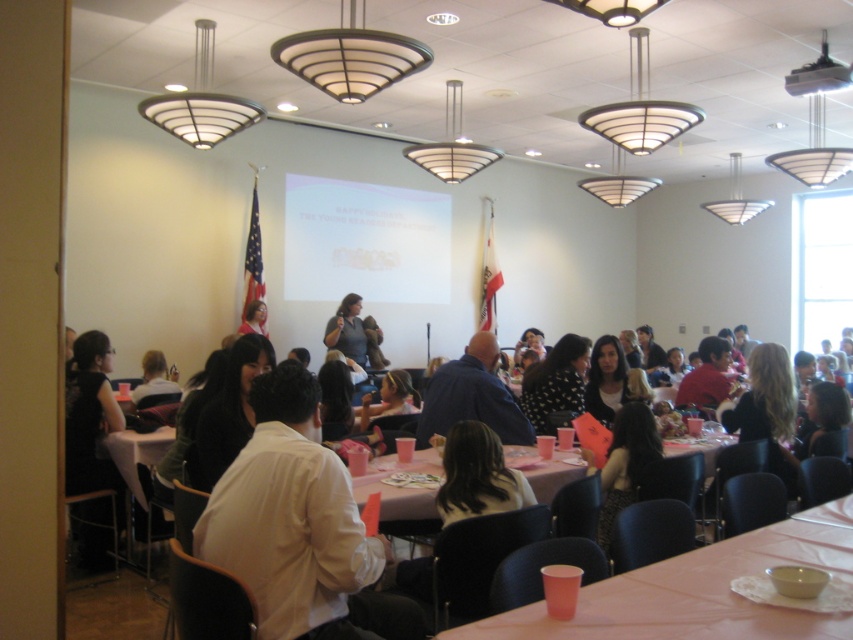
Consider the image. You are a photographer at the event and want to take a photo of the white shirt at center and the metallic projector at upper center. Which object is shorter?

The white shirt at center is shorter than the metallic projector at upper center.

You are a guest at the event and want to see the presentation on the white matte projection screen at upper center. However, you notice a blue shirt at center is blocking your view. Can you see the screen over their head?

The white matte projection screen at upper center is located above the blue shirt at center, so yes, you can see the screen over their head.